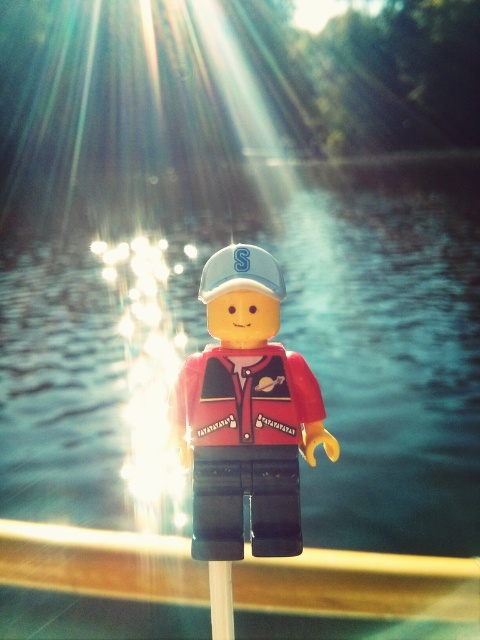
You are a photographer trying to capture the matte red plastic minifigure at center and the white plastic pole at center in a single shot. Which object will appear bigger in your photo?

The matte red plastic minifigure at center will appear bigger in the photo because it is larger in size than the white plastic pole at center.

You are a photographer trying to capture the LEGO minifigure in the scene. The point marked at coordinates [370,333] is important for your composition. What is located at that point?

The point marked at coordinates [370,333] marks blue water at center.

You are holding a camera and want to take a photo of the LEGO minifigure in the scene. The camera has a focus range of 1.5 meters. Can the camera focus on the point at coordinates point [475,410]?

The point [475,410] is 1.42 meters from the camera, which is within the focus range of 1.5 meters. Therefore, the camera can focus on the point [475,410].